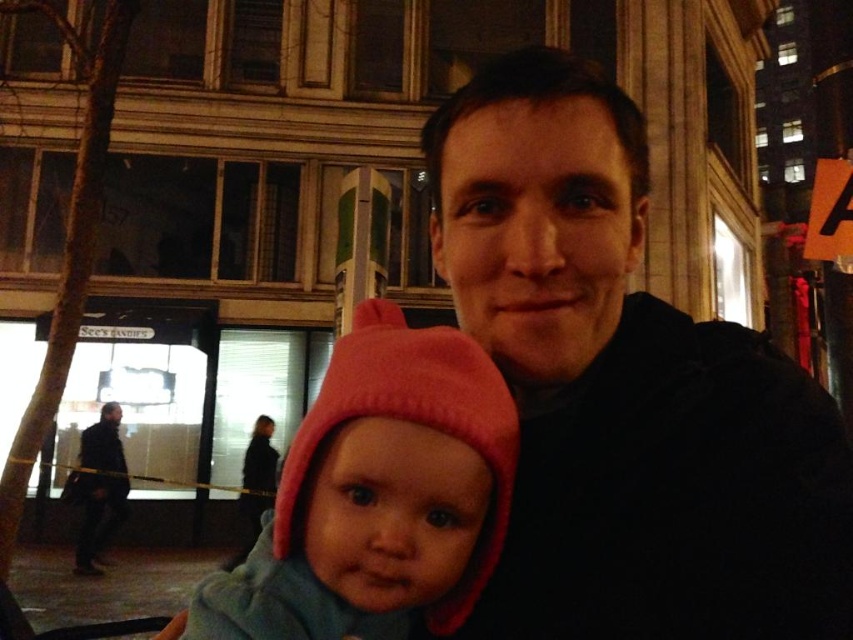
Question: Which point appears farthest from the camera in this image?

Choices:
 (A) (286, 529)
 (B) (486, 301)

Answer: (B)

Question: Which point is farther to the camera?

Choices:
 (A) (746, 596)
 (B) (498, 531)

Answer: (B)

Question: Which point is farther to the camera?

Choices:
 (A) (463, 637)
 (B) (425, 348)

Answer: (A)

Question: Can you confirm if black matte jacket at center is wider than pink fleece hat at center?

Choices:
 (A) no
 (B) yes

Answer: (B)

Question: In this image, where is black matte jacket at center located relative to pink fleece hat at center?

Choices:
 (A) right
 (B) left

Answer: (A)

Question: Is the position of black matte jacket at center less distant than that of pink fleece hat at center?

Choices:
 (A) no
 (B) yes

Answer: (A)